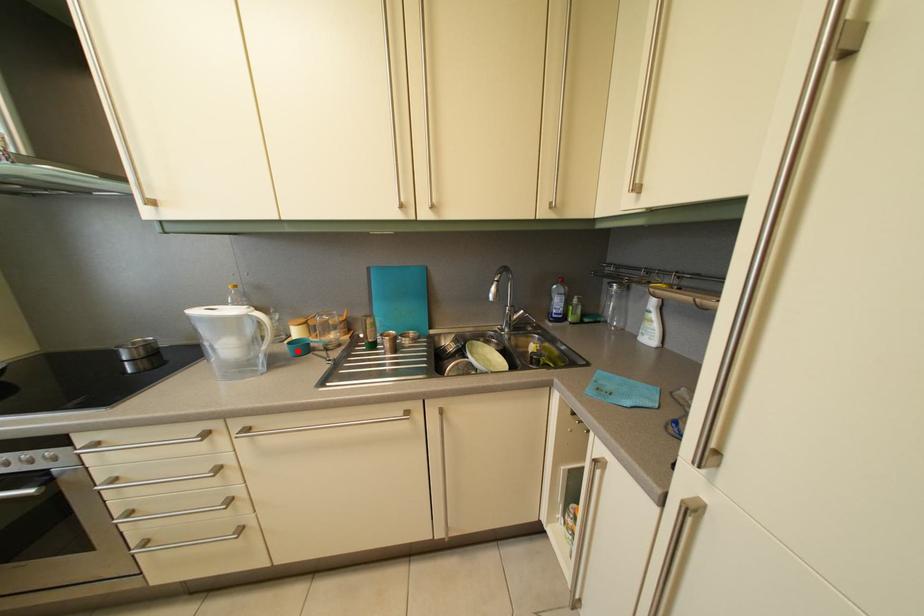
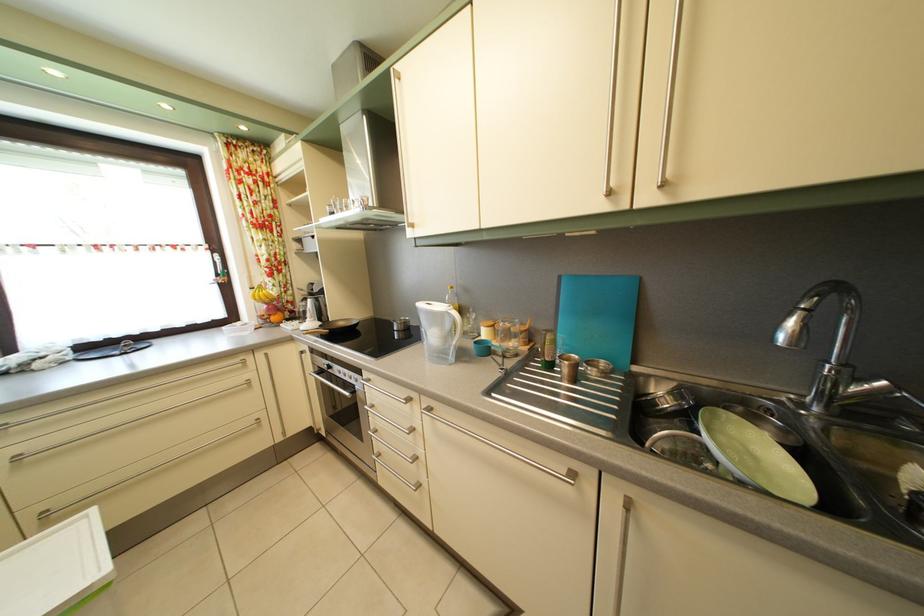
Locate, in the second image, the point that corresponds to the highlighted location in the first image.

(483, 350)